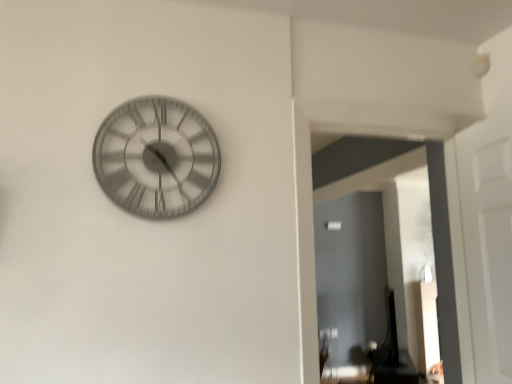
Question: Is metallic silver clock at upper left far away from transparent glass door at right?

Choices:
 (A) no
 (B) yes

Answer: (B)

Question: Does metallic silver clock at upper left turn towards transparent glass door at right?

Choices:
 (A) no
 (B) yes

Answer: (A)

Question: Is metallic silver clock at upper left positioned with its back to transparent glass door at right?

Choices:
 (A) no
 (B) yes

Answer: (A)

Question: Can you confirm if metallic silver clock at upper left is shorter than transparent glass door at right?

Choices:
 (A) no
 (B) yes

Answer: (B)

Question: From a real-world perspective, is metallic silver clock at upper left over transparent glass door at right?

Choices:
 (A) no
 (B) yes

Answer: (B)

Question: Is metallic silver clock at upper left further to camera compared to transparent glass door at right?

Choices:
 (A) no
 (B) yes

Answer: (A)

Question: Could you tell me if transparent glass door at right is turned towards metallic silver clock at upper left?

Choices:
 (A) no
 (B) yes

Answer: (B)

Question: Is transparent glass door at right closer to camera compared to metallic silver clock at upper left?

Choices:
 (A) yes
 (B) no

Answer: (B)

Question: From the image's perspective, does transparent glass door at right appear higher than metallic silver clock at upper left?

Choices:
 (A) no
 (B) yes

Answer: (A)

Question: From a real-world perspective, is transparent glass door at right located beneath metallic silver clock at upper left?

Choices:
 (A) yes
 (B) no

Answer: (A)

Question: Is transparent glass door at right completely or partially outside of metallic silver clock at upper left?

Choices:
 (A) yes
 (B) no

Answer: (A)

Question: From the image's perspective, would you say transparent glass door at right is shown under metallic silver clock at upper left?

Choices:
 (A) yes
 (B) no

Answer: (A)

Question: Considering their positions, is metallic silver clock at upper left located in front of or behind transparent glass door at right?

Choices:
 (A) front
 (B) behind

Answer: (A)